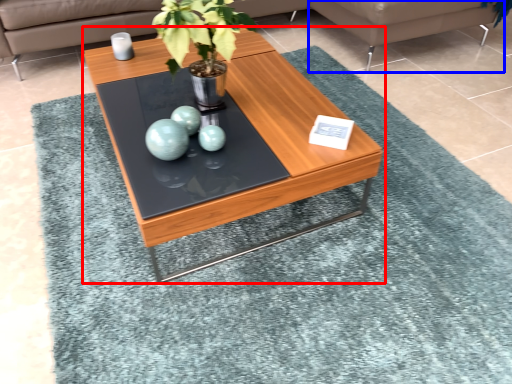
Question: Which point is further to the camera, coffee table (highlighted by a red box) or couch (highlighted by a blue box)?

Choices:
 (A) coffee table
 (B) couch

Answer: (B)